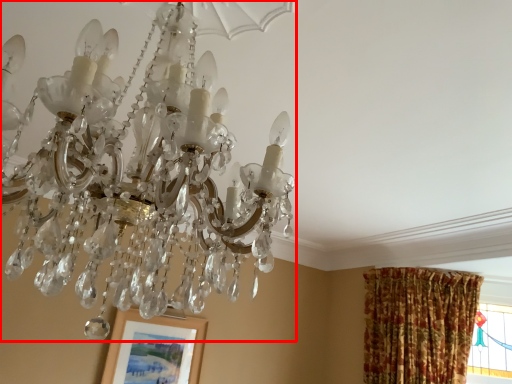
Question: From the image's perspective, considering the relative positions of lamp (annotated by the red box) and picture frame in the image provided, where is lamp (annotated by the red box) located with respect to the staircase?

Choices:
 (A) above
 (B) below

Answer: (A)